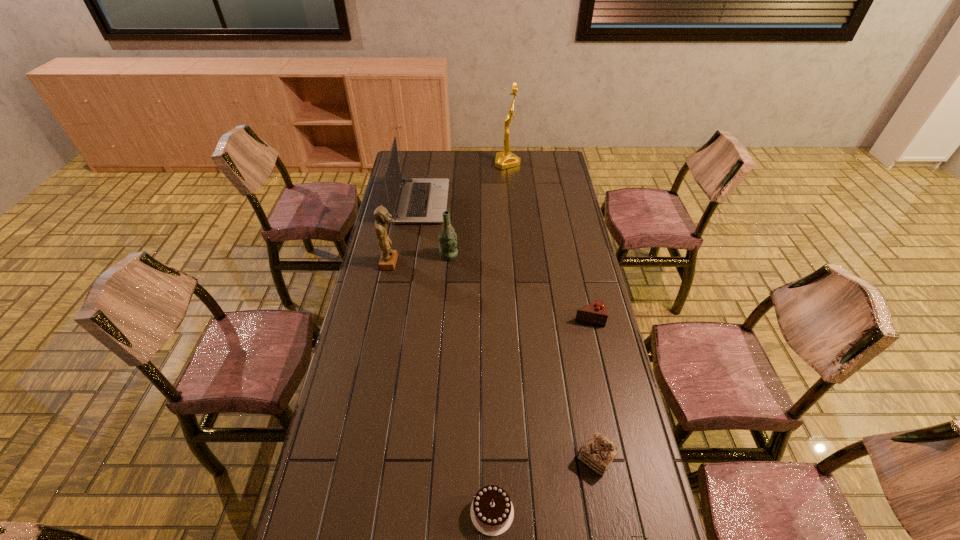
The width and height of the screenshot is (960, 540). I want to click on vacant space located on the front-facing side of the farthest object, so click(439, 163).

I want to click on vacant space situated 0.200m on the front-facing side of the farthest object, so click(458, 163).

The width and height of the screenshot is (960, 540). Find the location of `free point located 0.140m on the front-facing side of the figurine`. free point located 0.140m on the front-facing side of the figurine is located at coordinates (433, 262).

At what (x,y) coordinates should I click in order to perform the action: click on free region located 0.290m on the screen of the laptop computer. Please return your answer as a coordinate pair (x, y). This screenshot has height=540, width=960. Looking at the image, I should click on (508, 202).

Locate an element on the screen. vacant area located on the surface of the beer bottle is located at coordinates (489, 255).

Where is `free space located 0.110m on the back of the second nearest object`? The image size is (960, 540). free space located 0.110m on the back of the second nearest object is located at coordinates tap(491, 449).

Where is `free space located 0.340m on the front of the farthest chocolate cake`? The width and height of the screenshot is (960, 540). free space located 0.340m on the front of the farthest chocolate cake is located at coordinates (611, 415).

This screenshot has width=960, height=540. Identify the location of vacant region located 0.360m on the back of the sixth farthest object. (574, 340).

Identify the location of object present at the far edge. (506, 159).

I want to click on figurine that is at the left edge, so click(388, 259).